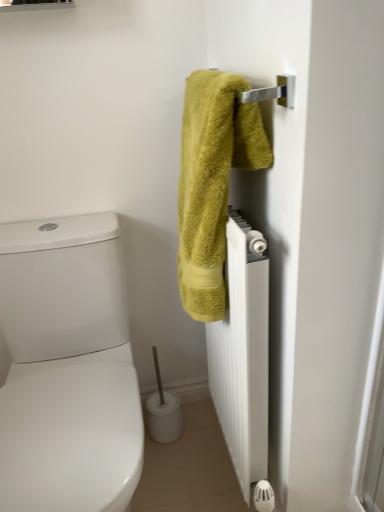
This screenshot has width=384, height=512. What do you see at coordinates (243, 353) in the screenshot? I see `white matte radiator at right` at bounding box center [243, 353].

Where is `white matte radiator at right`? white matte radiator at right is located at coordinates (243, 353).

The width and height of the screenshot is (384, 512). What do you see at coordinates (212, 182) in the screenshot?
I see `green fuzzy towel at upper right` at bounding box center [212, 182].

In the scene shown: What is the approximate width of green fuzzy towel at upper right?

It is 7.27 inches.

Find the location of a particular element. The height and width of the screenshot is (512, 384). green fuzzy towel at upper right is located at coordinates (212, 182).

This screenshot has height=512, width=384. In order to click on white matte radiator at right in this screenshot , I will do `click(243, 353)`.

Which is more to the left, white matte radiator at right or green fuzzy towel at upper right?

Positioned to the left is green fuzzy towel at upper right.

Which is behind, white matte radiator at right or green fuzzy towel at upper right?

white matte radiator at right.

Is point (253, 379) positioned before point (183, 159)?

No.

From the image's perspective, is white matte radiator at right on green fuzzy towel at upper right?

No.

From a real-world perspective, is white matte radiator at right above or below green fuzzy towel at upper right?

From a real-world perspective, white matte radiator at right is physically below green fuzzy towel at upper right.

Which of these two, white matte radiator at right or green fuzzy towel at upper right, is thinner?

white matte radiator at right is thinner.

Can you confirm if white matte radiator at right is taller than green fuzzy towel at upper right?

Correct, white matte radiator at right is much taller as green fuzzy towel at upper right.

Considering the sizes of objects white matte radiator at right and green fuzzy towel at upper right in the image provided, who is smaller, white matte radiator at right or green fuzzy towel at upper right?

green fuzzy towel at upper right is smaller.

Is white matte radiator at right spatially inside green fuzzy towel at upper right, or outside of it?

white matte radiator at right is outside green fuzzy towel at upper right.

Is white matte radiator at right beside green fuzzy towel at upper right?

No, white matte radiator at right is not beside green fuzzy towel at upper right.

Is white matte radiator at right aimed at green fuzzy towel at upper right?

No.

Locate an element on the screen. This screenshot has height=512, width=384. radiator lying on the right of green fuzzy towel at upper right is located at coordinates (243, 353).

Is green fuzzy towel at upper right to the right of white matte radiator at right from the viewer's perspective?

No, green fuzzy towel at upper right is not to the right of white matte radiator at right.

Who is more distant, green fuzzy towel at upper right or white matte radiator at right?

white matte radiator at right.

Which is nearer, (236, 96) or (244, 432)?

The point (236, 96) is closer.

From the image's perspective, would you say green fuzzy towel at upper right is positioned over white matte radiator at right?

Yes, from the image's perspective, green fuzzy towel at upper right is over white matte radiator at right.

From a real-world perspective, relative to white matte radiator at right, is green fuzzy towel at upper right vertically above or below?

Result: Clearly, from a real-world perspective, green fuzzy towel at upper right is above white matte radiator at right.

Consider the image. Does green fuzzy towel at upper right have a greater width compared to white matte radiator at right?

Indeed, green fuzzy towel at upper right has a greater width compared to white matte radiator at right.

Who is shorter, green fuzzy towel at upper right or white matte radiator at right?

green fuzzy towel at upper right is shorter.

Does green fuzzy towel at upper right have a smaller size compared to white matte radiator at right?

Yes, green fuzzy towel at upper right is smaller than white matte radiator at right.

Which is correct: green fuzzy towel at upper right is inside white matte radiator at right, or outside of it?

green fuzzy towel at upper right is located beyond the bounds of white matte radiator at right.

Is green fuzzy towel at upper right directly adjacent to white matte radiator at right?

No, green fuzzy towel at upper right is not with white matte radiator at right.

Is green fuzzy towel at upper right oriented away from white matte radiator at right?

No, white matte radiator at right is not at the back of green fuzzy towel at upper right.

This screenshot has height=512, width=384. In order to click on radiator on the right of green fuzzy towel at upper right in this screenshot , I will do `click(243, 353)`.

This screenshot has height=512, width=384. Find the location of `radiator behind the green fuzzy towel at upper right`. radiator behind the green fuzzy towel at upper right is located at coordinates (243, 353).

Find the location of `radiator that is below the green fuzzy towel at upper right (from the image's perspective)`. radiator that is below the green fuzzy towel at upper right (from the image's perspective) is located at coordinates (243, 353).